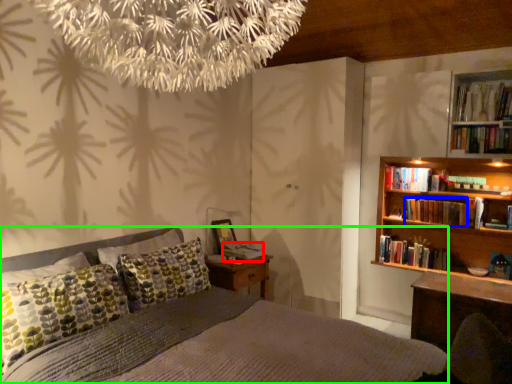
Question: Which is farther away from book (highlighted by a red box)? book (highlighted by a blue box) or bed (highlighted by a green box)?

Choices:
 (A) book
 (B) bed

Answer: (A)